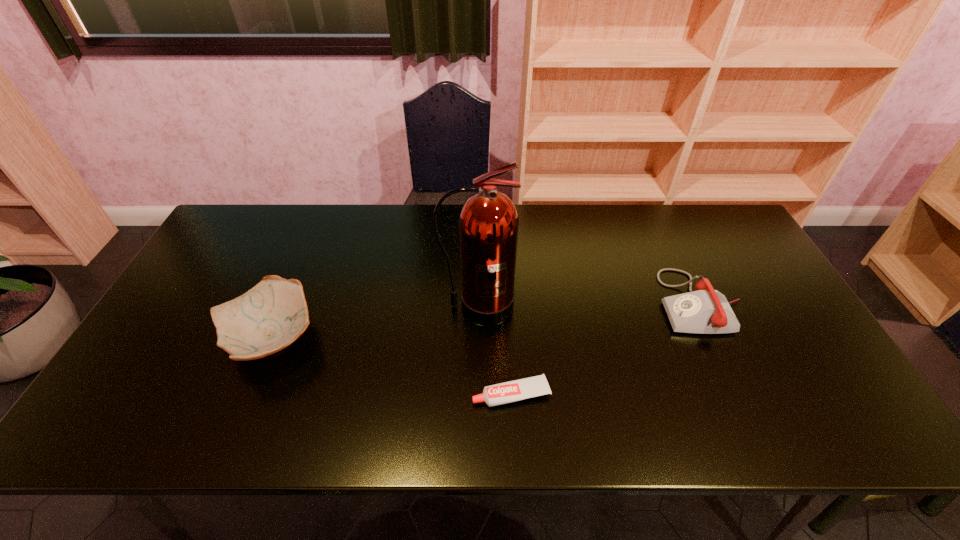
Identify the location of vacant space that satisfies the following two spatial constraints: 1. on the dial of the rightmost object; 2. on the front side of the third shortest object. This screenshot has width=960, height=540. click(x=717, y=339).

This screenshot has height=540, width=960. Identify the location of free spot that satisfies the following two spatial constraints: 1. on the front side of the second tallest object; 2. on the left side of the toothpaste. (249, 394).

You are a GUI agent. You are given a task and a screenshot of the screen. Output one action in this format:
    pyautogui.click(x=<x>, y=<y>)
    Task: Click on the vacant space that satisfies the following two spatial constraints: 1. on the front-facing side of the toothpaste; 2. on the right side of the fire extinguisher
    
    Given the screenshot: What is the action you would take?
    pyautogui.click(x=477, y=394)